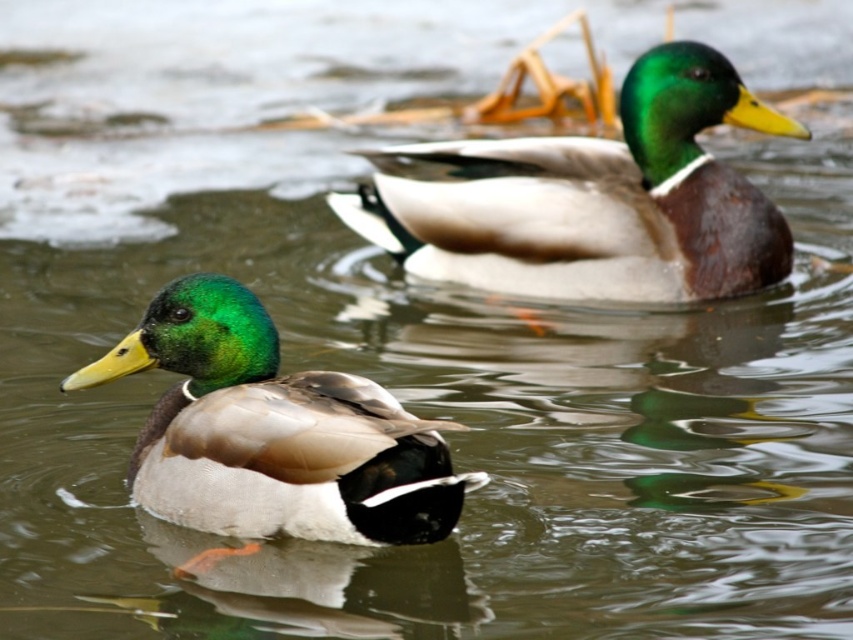
Question: Can you confirm if shiny brown duck at upper center is positioned below shiny green duck at center?

Choices:
 (A) no
 (B) yes

Answer: (A)

Question: Can you confirm if shiny brown duck at upper center is smaller than shiny green duck at center?

Choices:
 (A) yes
 (B) no

Answer: (B)

Question: Which object appears closest to the camera in this image?

Choices:
 (A) shiny brown duck at upper center
 (B) shiny green duck at center

Answer: (B)

Question: Can you confirm if shiny brown duck at upper center is positioned to the right of shiny green duck at center?

Choices:
 (A) yes
 (B) no

Answer: (A)

Question: Among these objects, which one is nearest to the camera?

Choices:
 (A) shiny brown duck at upper center
 (B) shiny green duck at center

Answer: (B)